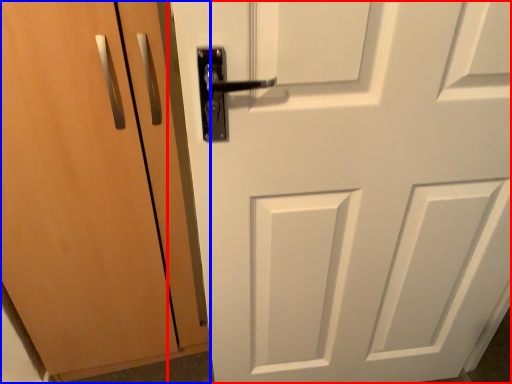
Question: Which object is closer to the camera taking this photo, door (highlighted by a red box) or door (highlighted by a blue box)?

Choices:
 (A) door
 (B) door

Answer: (A)